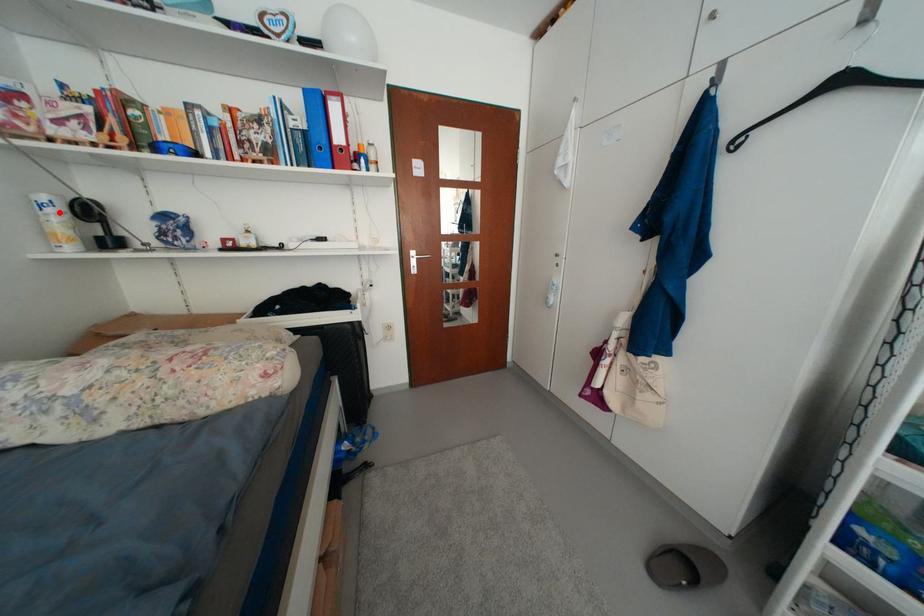
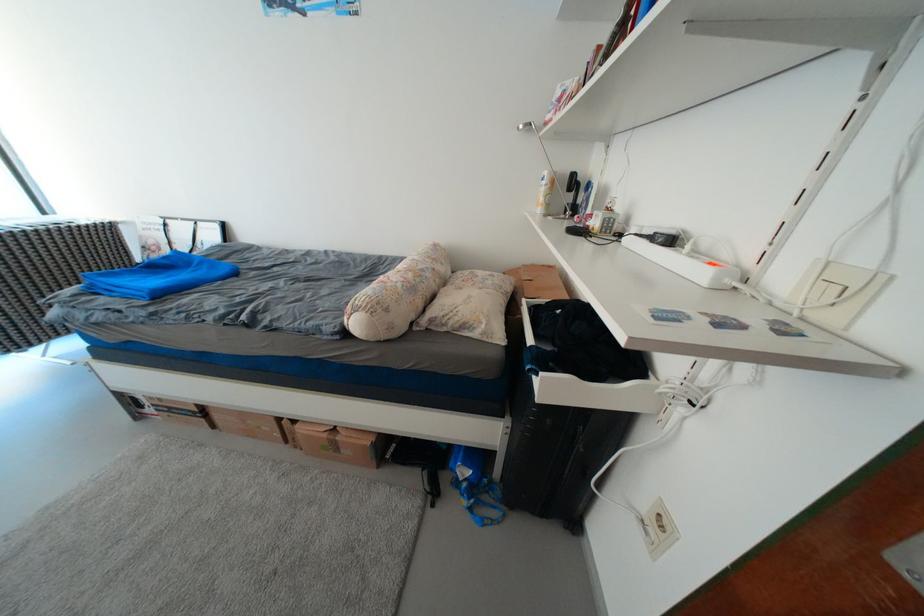
Question: I am providing you with two images of the same scene from different viewpoints. Given a red point in image1, look at the same physical point in image2. Is it:

Choices:
 (A) Closer to the viewpoint
 (B) Farther from the viewpoint

Answer: (A)